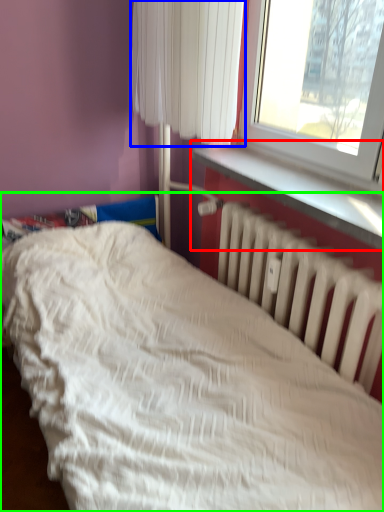
Question: Which is nearer to the window sill (highlighted by a red box)? curtain (highlighted by a blue box) or bed (highlighted by a green box).

Choices:
 (A) curtain
 (B) bed

Answer: (A)